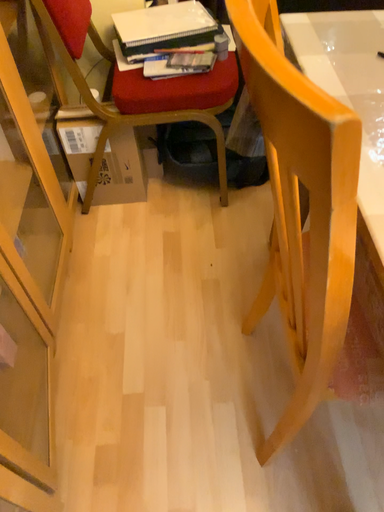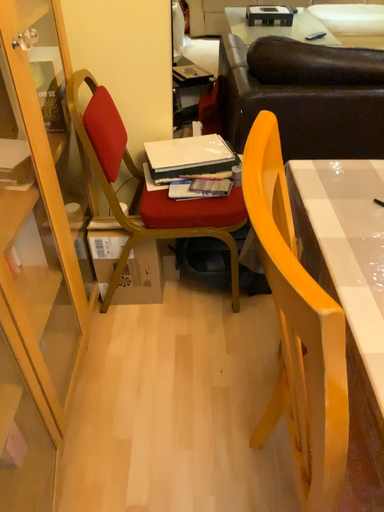
Question: Which way did the camera rotate in the video?

Choices:
 (A) rotated upward
 (B) rotated downward

Answer: (A)